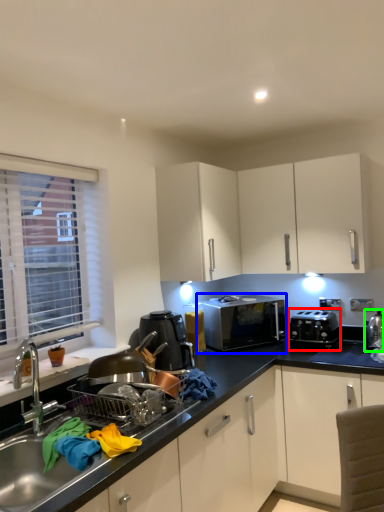
Question: Which object is positioned closest to appliance (highlighted by a red box)? Select from microwave oven (highlighted by a blue box) and appliance (highlighted by a green box).

Choices:
 (A) microwave oven
 (B) appliance

Answer: (A)